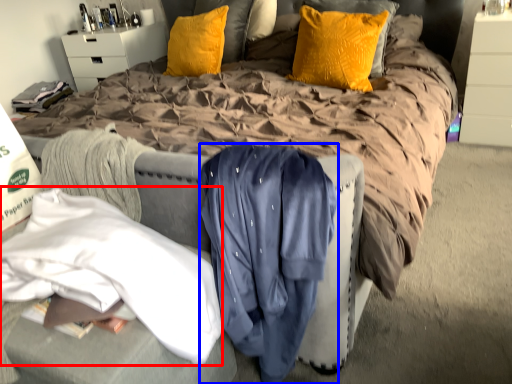
Question: Which point is further to the camera, clothing (highlighted by a red box) or clothing (highlighted by a blue box)?

Choices:
 (A) clothing
 (B) clothing

Answer: (B)